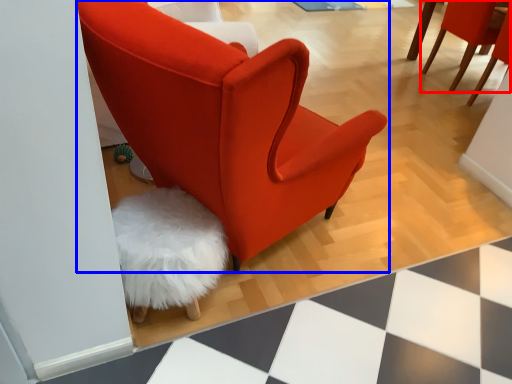
Question: Which point is further to the camera, chair (highlighted by a red box) or chair (highlighted by a blue box)?

Choices:
 (A) chair
 (B) chair

Answer: (A)